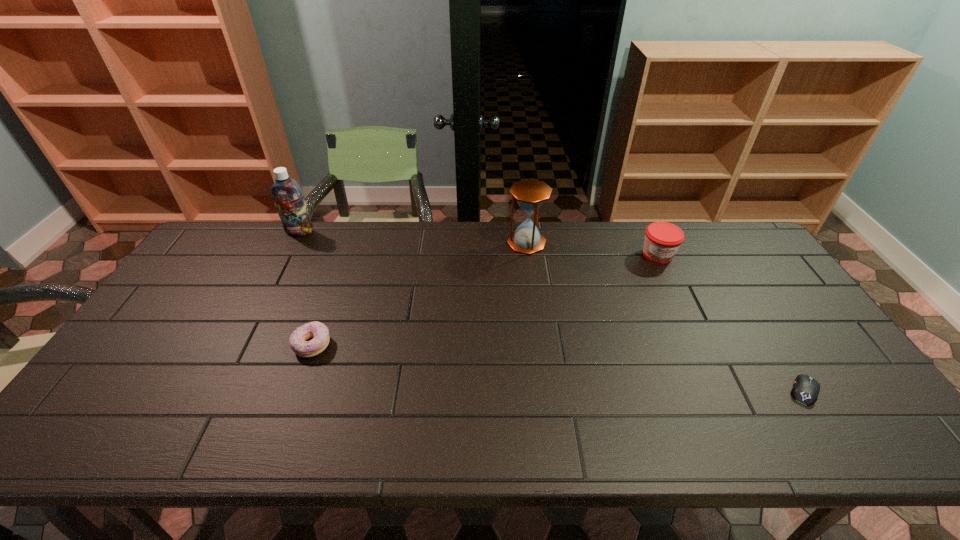
What are the coordinates of `shampoo` in the screenshot? It's located at (288, 197).

Where is `the third object from right to left`? This screenshot has height=540, width=960. the third object from right to left is located at coordinates (530, 194).

I want to click on the fourth shortest object, so click(x=530, y=194).

Image resolution: width=960 pixels, height=540 pixels. I want to click on jam, so click(x=662, y=239).

This screenshot has height=540, width=960. I want to click on the fourth object from left to right, so click(x=662, y=239).

The width and height of the screenshot is (960, 540). I want to click on doughnut, so click(x=297, y=341).

Where is `the second object from left to right`? This screenshot has height=540, width=960. the second object from left to right is located at coordinates (297, 341).

The width and height of the screenshot is (960, 540). What are the coordinates of `the rightmost object` in the screenshot? It's located at [806, 389].

Where is `the shortest object`? The width and height of the screenshot is (960, 540). the shortest object is located at coordinates (806, 389).

This screenshot has height=540, width=960. In order to click on free space located 0.340m on the front label of the shampoo in this screenshot , I will do `click(261, 308)`.